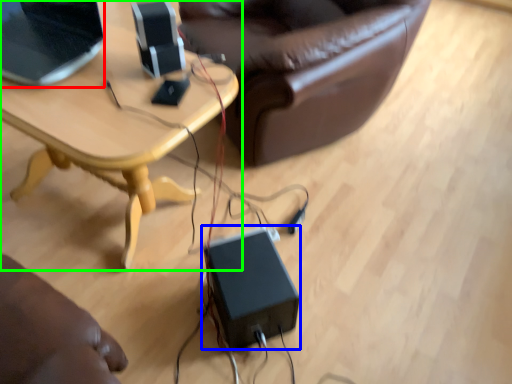
Question: Based on their relative distances, which object is farther from laptop (highlighted by a red box)? Choose from speaker (highlighted by a blue box) and table (highlighted by a green box).

Choices:
 (A) speaker
 (B) table

Answer: (A)